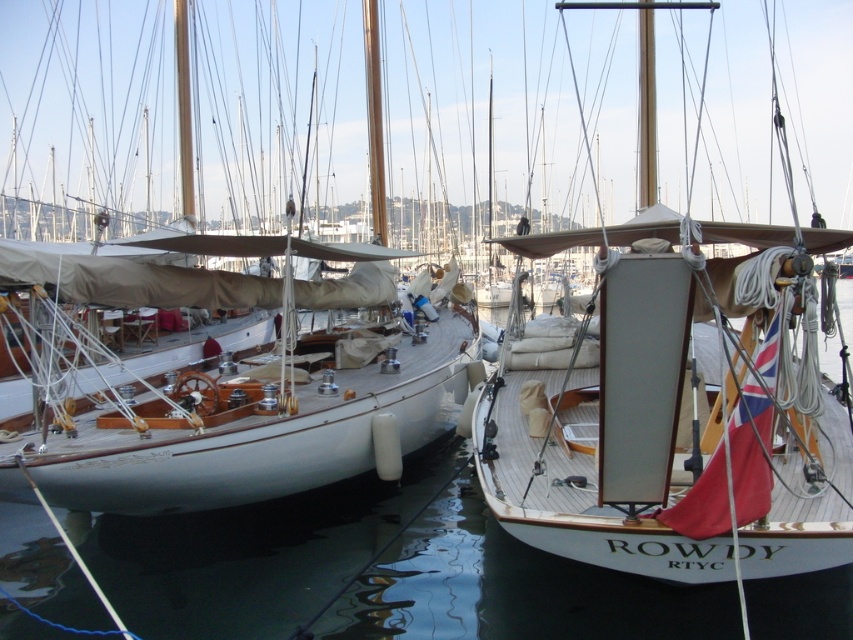
Does clear water at center have a lesser width compared to white polished wood boat at center?

Incorrect, clear water at center's width is not less than white polished wood boat at center's.

The image size is (853, 640). What do you see at coordinates (252, 554) in the screenshot?
I see `clear water at center` at bounding box center [252, 554].

Locate an element on the screen. This screenshot has height=640, width=853. clear water at center is located at coordinates (252, 554).

Can you confirm if wooden sailboat at center is taller than clear water at center?

Correct, wooden sailboat at center is much taller as clear water at center.

Is wooden sailboat at center shorter than clear water at center?

No, wooden sailboat at center is not shorter than clear water at center.

Which is in front, point (587, 513) or point (183, 525)?

Point (587, 513) is more forward.

Locate an element on the screen. The image size is (853, 640). wooden sailboat at center is located at coordinates (672, 410).

What do you see at coordinates (672, 410) in the screenshot? I see `wooden sailboat at center` at bounding box center [672, 410].

Can you confirm if wooden sailboat at center is wider than white polished wood boat at center?

Indeed, wooden sailboat at center has a greater width compared to white polished wood boat at center.

Who is more distant from viewer, (679, 384) or (165, 248)?

The point (165, 248) is more distant.

Identify the location of wooden sailboat at center. (672, 410).